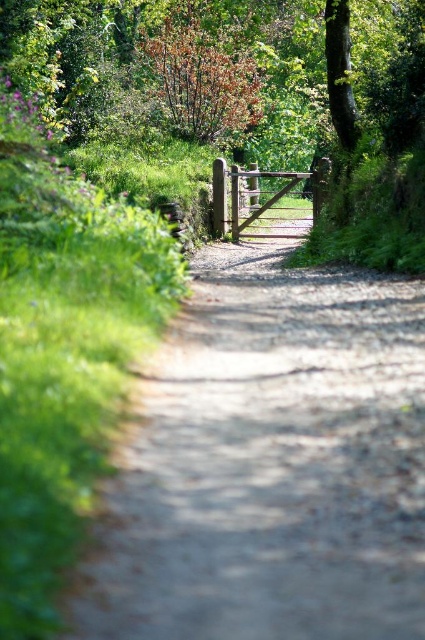
Question: Can you confirm if dirt/gravel path at center is positioned to the right of brown textured tree at upper center?

Choices:
 (A) no
 (B) yes

Answer: (B)

Question: Where is dirt/gravel path at center located in relation to brown textured tree at upper center in the image?

Choices:
 (A) right
 (B) left

Answer: (A)

Question: Can you confirm if dirt/gravel path at center is smaller than brown textured tree at upper center?

Choices:
 (A) yes
 (B) no

Answer: (B)